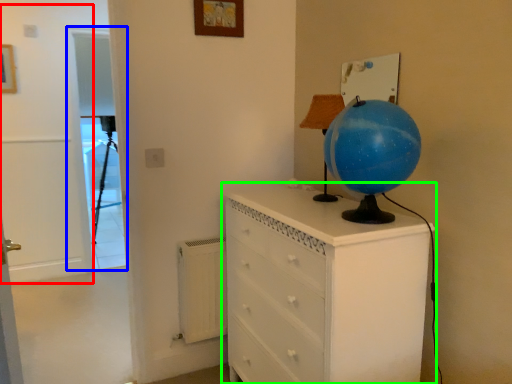
Question: Based on their relative distances, which object is farther from door (highlighted by a red box)? Choose from screen door (highlighted by a blue box) and chest of drawers (highlighted by a green box).

Choices:
 (A) screen door
 (B) chest of drawers

Answer: (B)